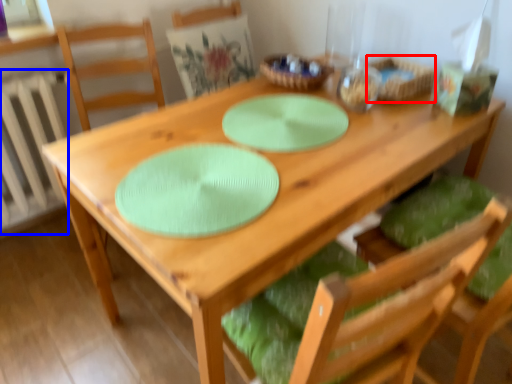
Question: Which of the following is the closest to the observer, basket (highlighted by a red box) or radiator (highlighted by a blue box)?

Choices:
 (A) basket
 (B) radiator

Answer: (A)